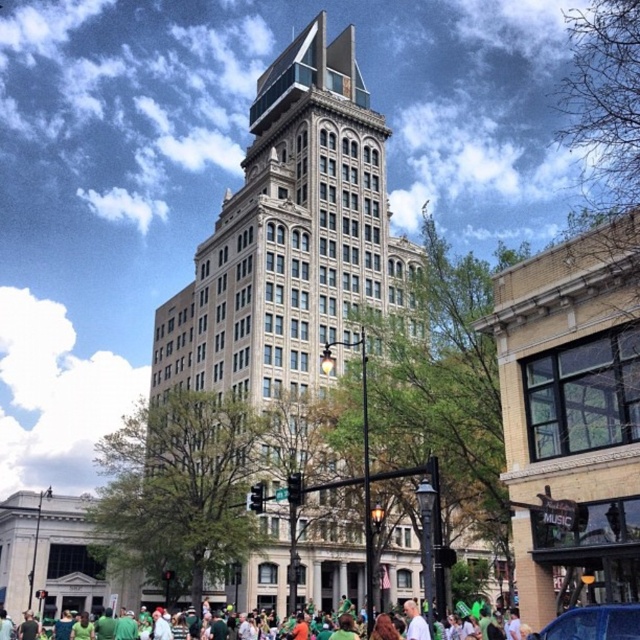
Question: Which point is farther from the camera taking this photo?

Choices:
 (A) (616, 620)
 (B) (83, 634)

Answer: (B)

Question: Is beige stone building at center to the left of shiny blue car at lower right from the viewer's perspective?

Choices:
 (A) no
 (B) yes

Answer: (B)

Question: Among these points, which one is nearest to the camera?

Choices:
 (A) (602, 628)
 (B) (244, 588)

Answer: (A)

Question: Can you confirm if beige stone building at center is positioned below shiny blue car at lower right?

Choices:
 (A) yes
 (B) no

Answer: (B)

Question: Which object is positioned closest to the beige stone building at center?

Choices:
 (A) green fabric crowd at lower center
 (B) shiny blue car at lower right

Answer: (A)

Question: Does beige stone building at center have a lesser width compared to green fabric crowd at lower center?

Choices:
 (A) yes
 (B) no

Answer: (A)